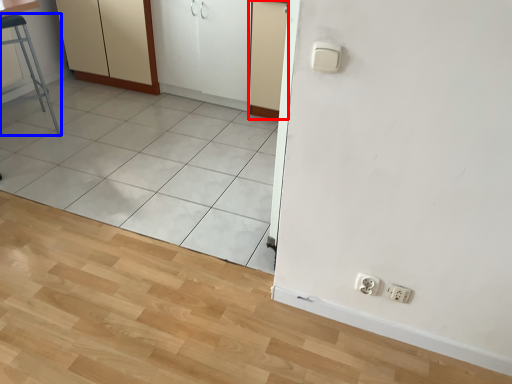
Question: Which point is closer to the camera, screen door (highlighted by a red box) or furniture (highlighted by a blue box)?

Choices:
 (A) screen door
 (B) furniture

Answer: (B)